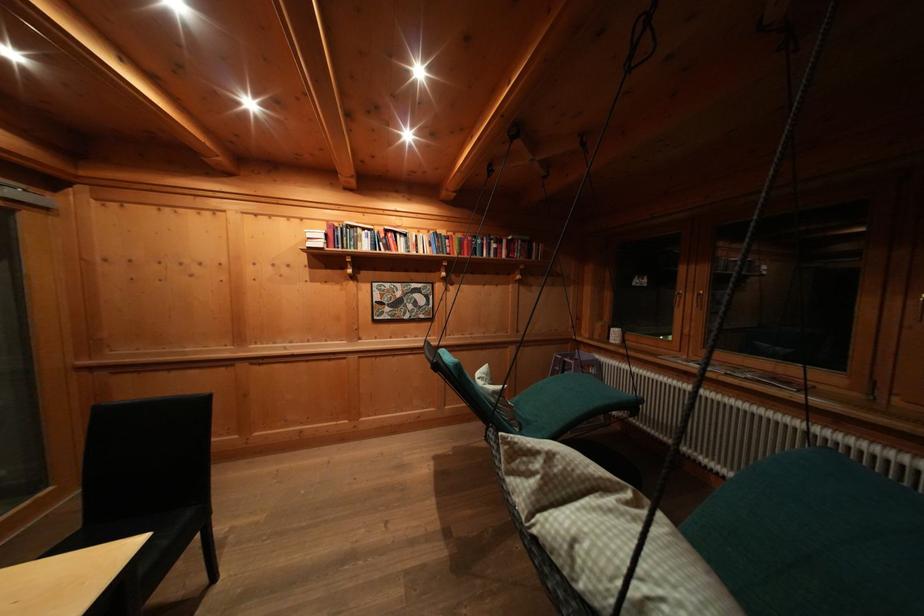
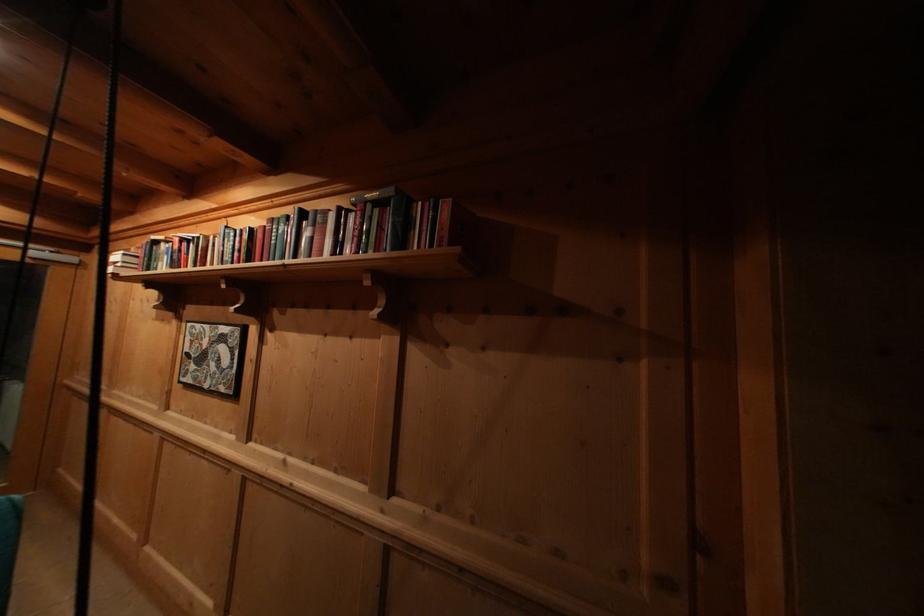
The point at [393,236] is marked in the first image. Where is the corresponding point in the second image?

(188, 246)